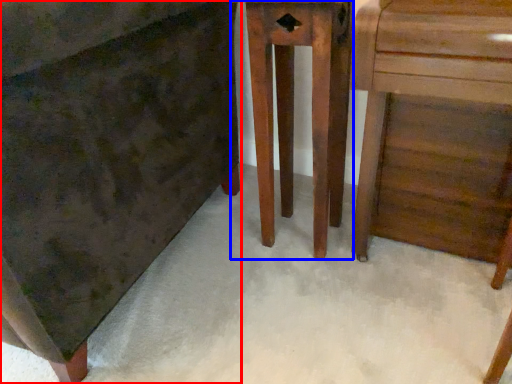
Question: Which object appears closest to the camera in this image, chest of drawers (highlighted by a red box) or furniture (highlighted by a blue box)?

Choices:
 (A) chest of drawers
 (B) furniture

Answer: (A)